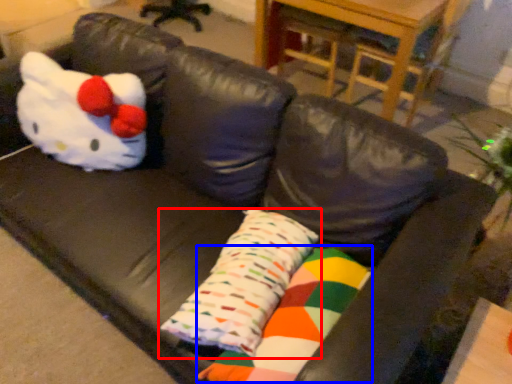
Question: Which of the following is the closest to the observer, pillow (highlighted by a red box) or material (highlighted by a blue box)?

Choices:
 (A) pillow
 (B) material

Answer: (B)